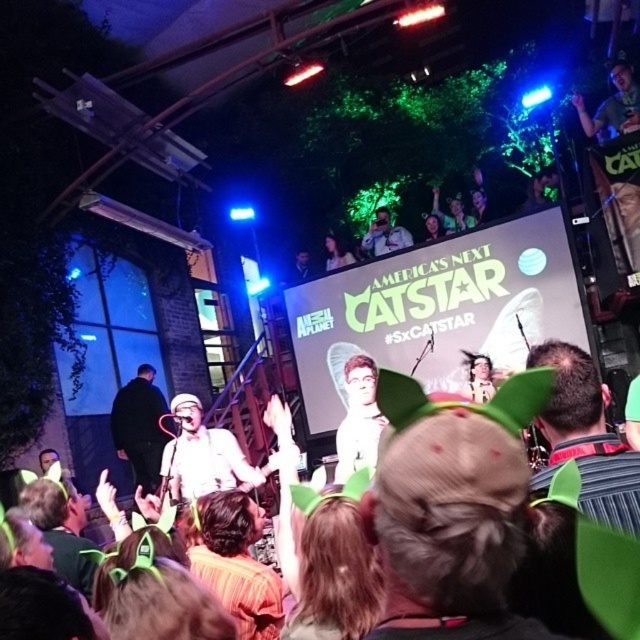
You are a photographer at the event and need to capture a photo of both the dark brown hair at center and the striped shirt at lower center. Based on their heights, which one should you focus on first to ensure both are in frame?

Since the dark brown hair at center is shorter than the striped shirt at lower center, you should focus on the striped shirt at lower center first to ensure both are in frame.

You are a photographer standing at the back of the stage. You want to take a photo that includes both the striped shirt at lower center and the performer holding the microphone. How far apart should you position them in your camera frame?

The striped shirt at lower center and the performer holding the microphone are 1.66 meters apart. To capture both in the frame, ensure they are positioned 1.66 meters apart in your camera view.

You are standing at the center of the stage and want to hand a microphone to the performer wearing the striped shirt at lower center. Based on their position, in which direction should you move to reach them?

The striped shirt at lower center is located at point 0.883 on the x axis and 0.372 on the y axis. Since you are at the center of the stage, you should move towards the lower right direction to reach the striped shirt at lower center.